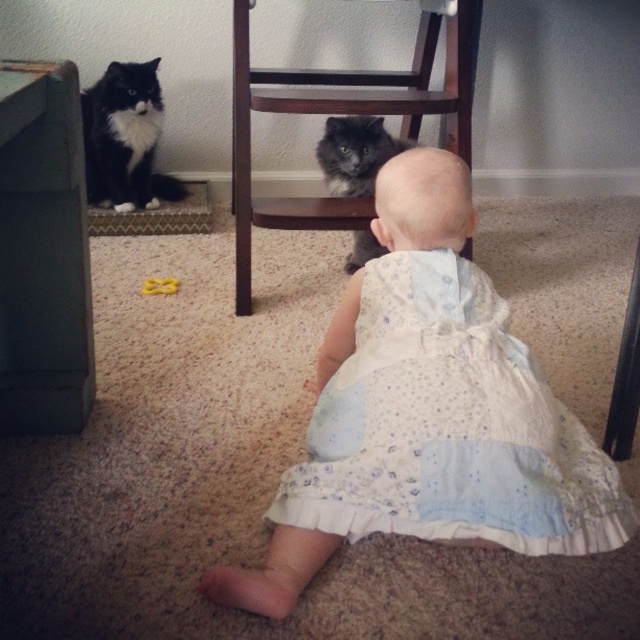
Between black fluffy cat at upper left and fluffy gray cat at center, which one is positioned higher?

black fluffy cat at upper left is higher up.

Which is more to the left, black fluffy cat at upper left or fluffy gray cat at center?

Positioned to the left is black fluffy cat at upper left.

I want to click on black fluffy cat at upper left, so click(125, 138).

Who is higher up, white dotted fabric dress at center or black fluffy cat at upper left?

Positioned higher is black fluffy cat at upper left.

Does white dotted fabric dress at center have a larger size compared to black fluffy cat at upper left?

Correct, white dotted fabric dress at center is larger in size than black fluffy cat at upper left.

Which is behind, point (454, 269) or point (157, 193)?

The point (157, 193) is more distant.

At what (x,y) coordinates should I click in order to perform the action: click on white dotted fabric dress at center. Please return your answer as a coordinate pair (x, y). The height and width of the screenshot is (640, 640). Looking at the image, I should click on (449, 428).

Which is more to the left, white dotted fabric dress at center or fluffy gray cat at center?

fluffy gray cat at center

Does point (499, 538) come closer to viewer compared to point (369, 236)?

Yes, it is in front of point (369, 236).

Does point (580, 528) come closer to viewer compared to point (353, 236)?

Yes.

At what (x,y) coordinates should I click in order to perform the action: click on white dotted fabric dress at center. Please return your answer as a coordinate pair (x, y). This screenshot has height=640, width=640. Looking at the image, I should click on (449, 428).